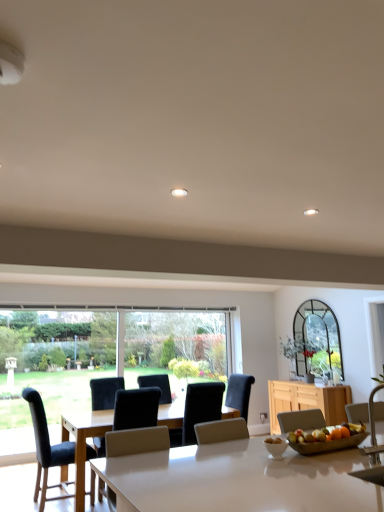
Question: Considering the positions of metallic silver chair at right, the fourth chair when ordered from left to right, and velvet black chair at center, which is the 3th chair from right to left, in the image, is metallic silver chair at right, the fourth chair when ordered from left to right, taller or shorter than velvet black chair at center, which is the 3th chair from right to left,?

Choices:
 (A) short
 (B) tall

Answer: (A)

Question: Is point (375, 415) closer or farther from the camera than point (135, 414)?

Choices:
 (A) farther
 (B) closer

Answer: (B)

Question: Which of these objects is positioned closest to the wooden cabinet at right?

Choices:
 (A) black leather chair at center, the second chair in the right-to-left sequence
 (B) velvet black chair at center, which is counted as the 2th chair, starting from the front
 (C) white glossy table at center
 (D) white glossy bowl at center
 (E) metallic silver chair at right, which is the first chair in right-to-left order

Answer: (D)

Question: Which object is the closest to the black leather chair at center, which is counted as the 3th chair, starting from the left?

Choices:
 (A) velvet black chair at center, positioned as the third chair in back-to-front order
 (B) metallic silver chair at right, which appears as the 1th chair when viewed from the front
 (C) white glossy bowl at center
 (D) white glossy table at center
 (E) black leather chair at left, which ranks as the 1th chair in left-to-right order

Answer: (A)